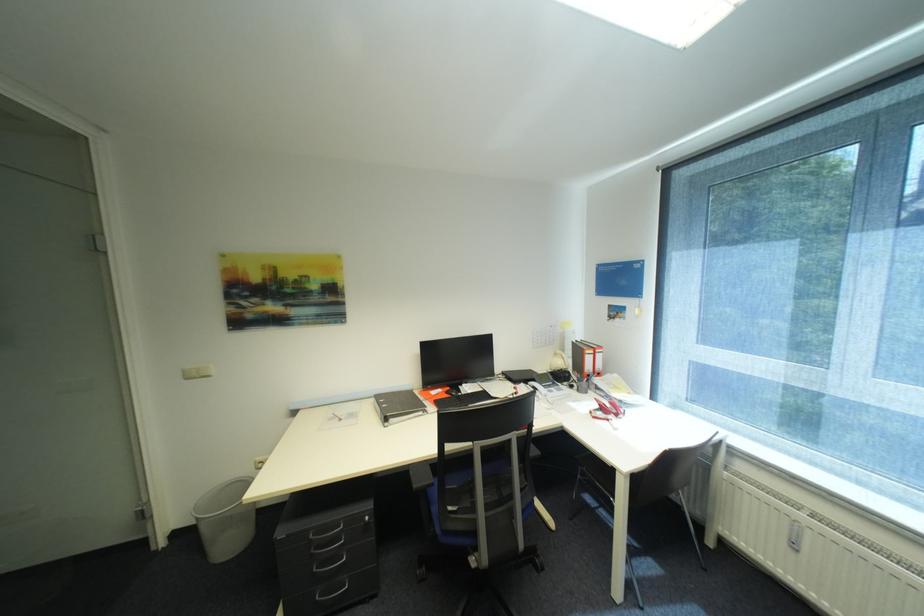
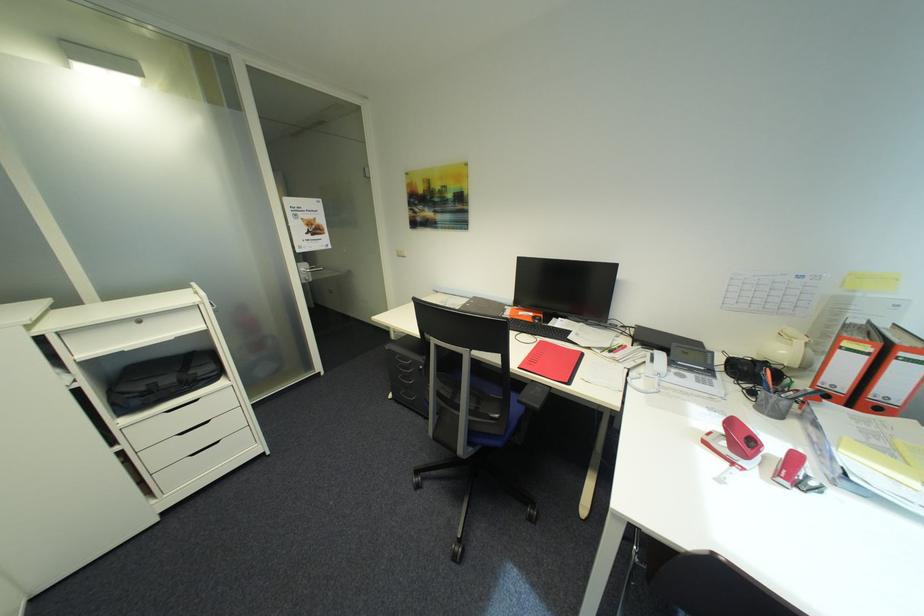
In the second image, find the point that corresponds to point 579,387 in the first image.

(760, 392)